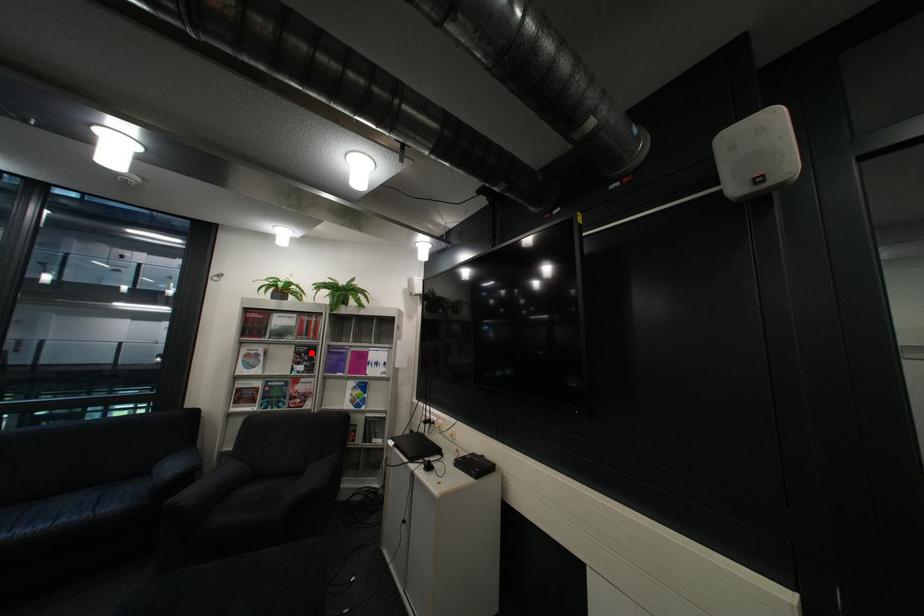
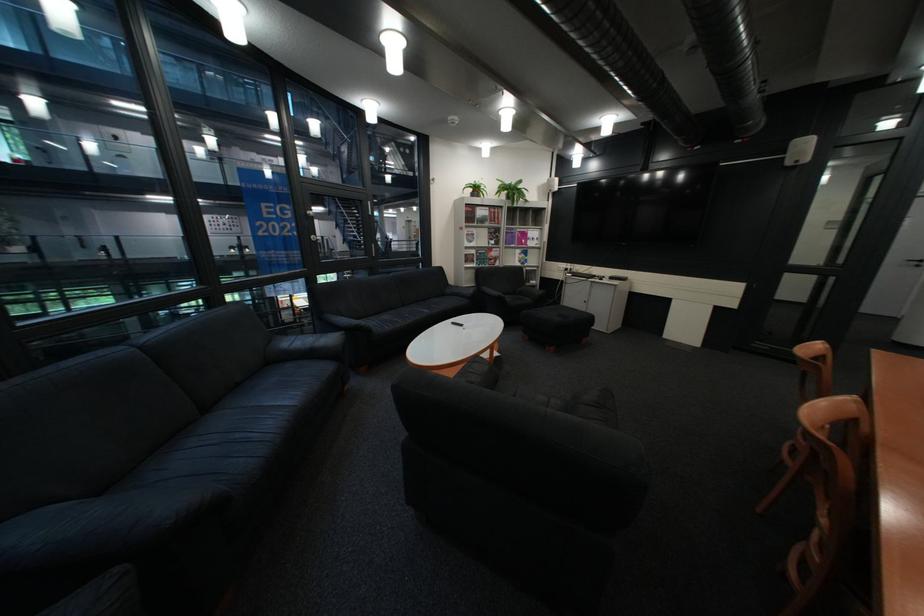
Question: I am providing you with two images of the same scene from different viewpoints. Given a red point in image1, look at the same physical point in image2. Is it:

Choices:
 (A) Closer to the viewpoint
 (B) Farther from the viewpoint

Answer: (A)